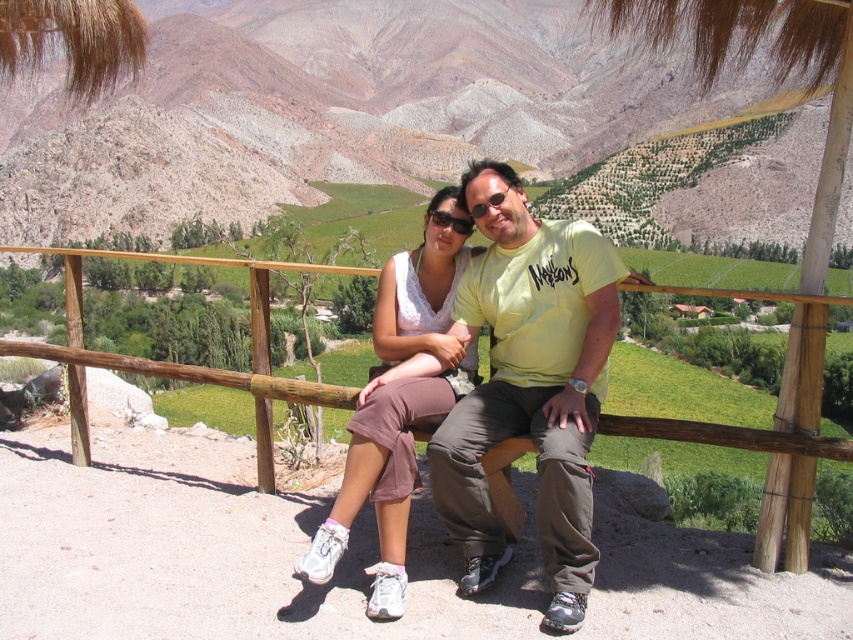
You are standing at the base of the rustic stone mountains at upper center and want to reach the wooden rail at center where two people are sitting. Which direction should you move to get there?

The rustic stone mountains at upper center is located above the wooden rail at center, so you should move downward to reach the wooden rail at center.

You are standing at the point labeled point (329, 109) in the image. What type of terrain are you standing on?

The point (329, 109) is on rustic stone mountains at upper center.